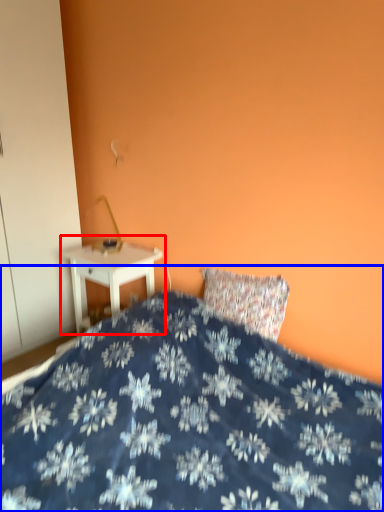
Question: Which of the following is the farthest to the observer, nightstand (highlighted by a red box) or bed (highlighted by a blue box)?

Choices:
 (A) nightstand
 (B) bed

Answer: (A)